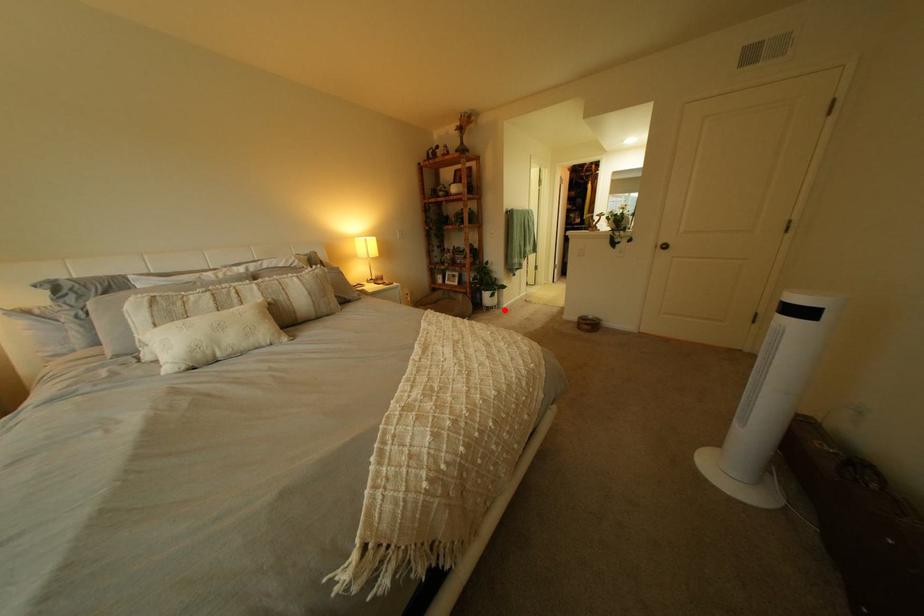
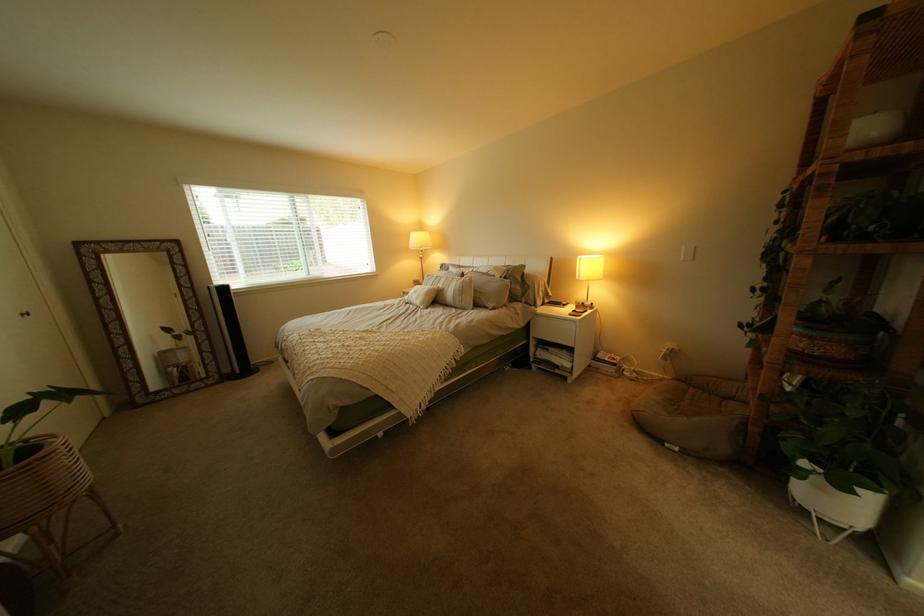
Find the pixel in the second image that matches the highlighted location in the first image.

(821, 512)